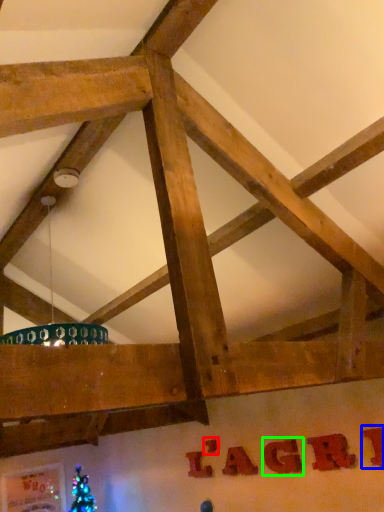
Question: Which is farther away from letter (highlighted by a red box)? letter (highlighted by a blue box) or letter (highlighted by a green box)?

Choices:
 (A) letter
 (B) letter

Answer: (A)